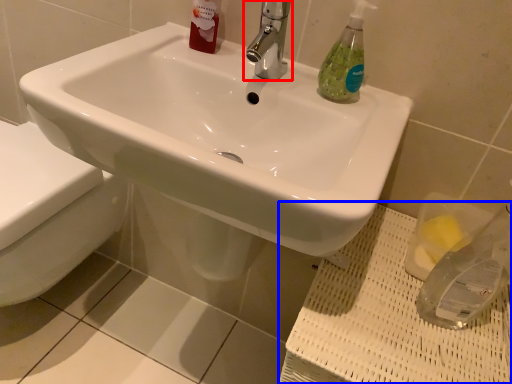
Question: Which point is closer to the camera, tap (highlighted by a red box) or porcelain (highlighted by a blue box)?

Choices:
 (A) tap
 (B) porcelain

Answer: (B)